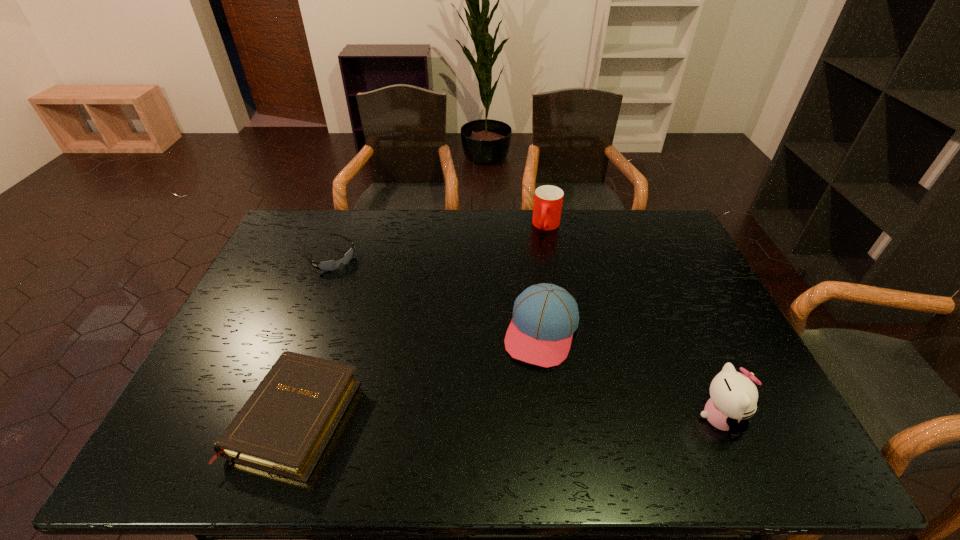
At what (x,y) coordinates should I click in order to perform the action: click on vacant space on the desktop that is between the Bible and the kitten and is positioned on the lenses of the shortest object. Please return your answer as a coordinate pair (x, y). The image size is (960, 540). Looking at the image, I should click on (501, 417).

The height and width of the screenshot is (540, 960). In order to click on vacant spot on the desktop that is between the Bible and the kitten and is positioned on the side of the cup with the handle in this screenshot , I will do `click(468, 417)`.

In order to click on vacant space on the desktop that is between the Bible and the kitten and is positioned on the front-facing side of the baseball cap in this screenshot , I will do `click(511, 417)`.